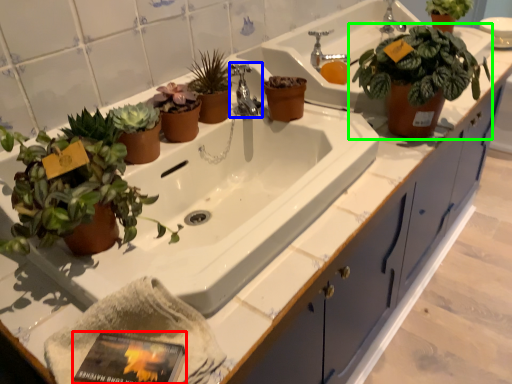
Question: Which object is the closest to the paperback book (highlighted by a red box)? Choose among these: tap (highlighted by a blue box) or houseplant (highlighted by a green box).

Choices:
 (A) tap
 (B) houseplant

Answer: (A)